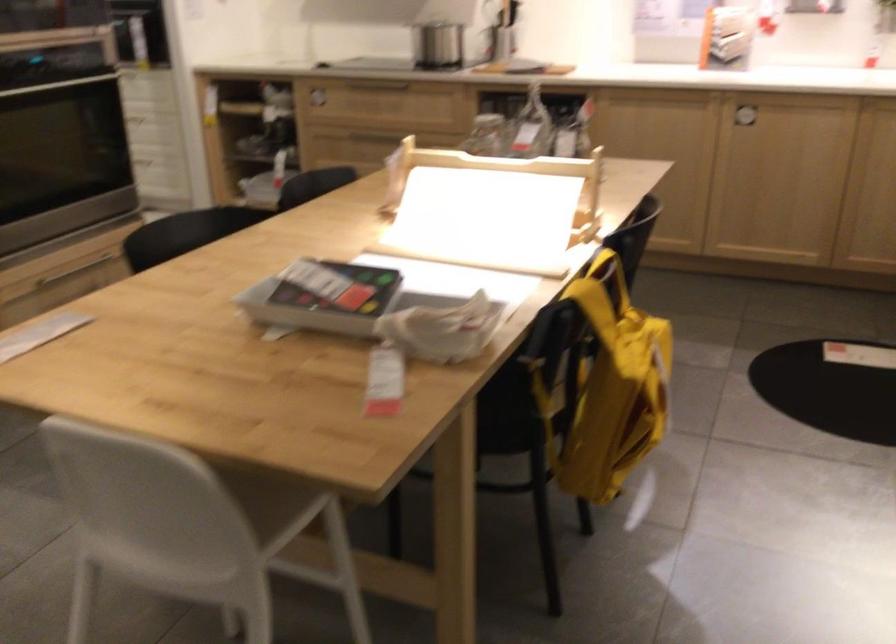
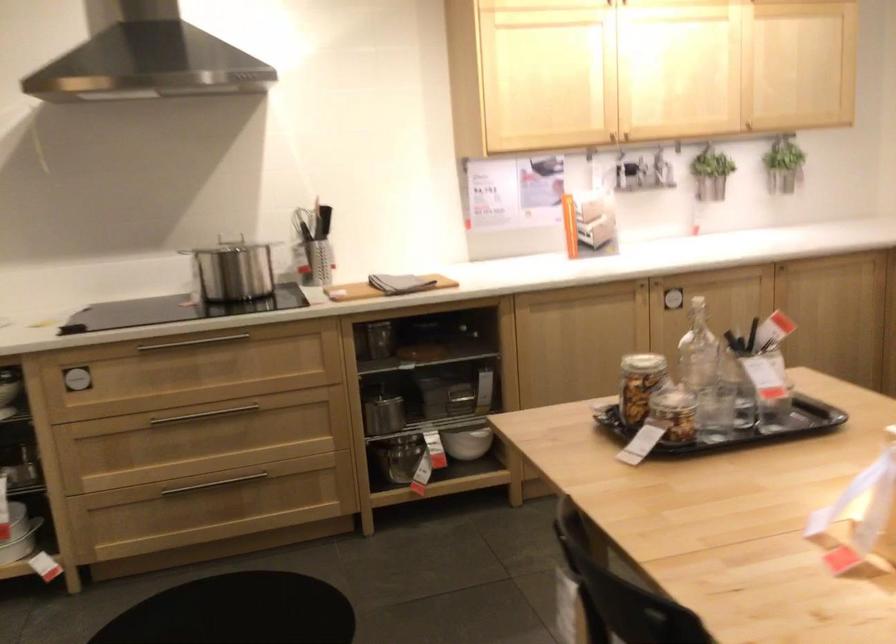
Where in the second image is the point corresponding to pixel 485 134 from the first image?

(640, 384)